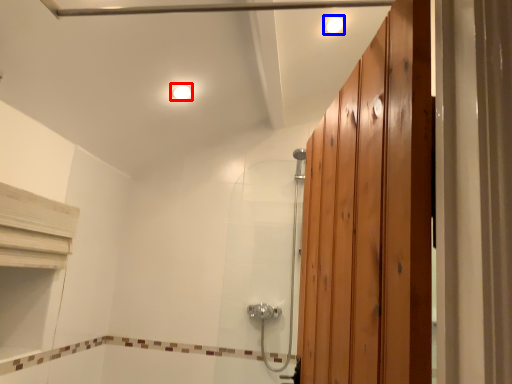
Question: Which object is closer to the camera taking this photo, light fixture (highlighted by a red box) or light fixture (highlighted by a blue box)?

Choices:
 (A) light fixture
 (B) light fixture

Answer: (B)